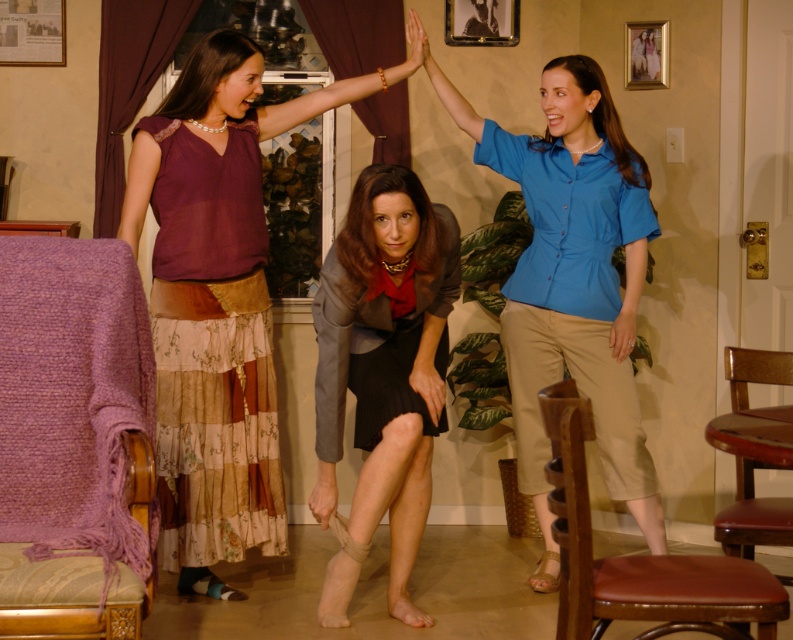
Question: Is blue button-up shirt at upper right bigger than matte gray sleeve at center?

Choices:
 (A) no
 (B) yes

Answer: (B)

Question: Which point is closer to the camera?

Choices:
 (A) (714, 580)
 (B) (156, 160)
 (C) (175, 177)

Answer: (A)

Question: Which object is the farthest from the wooden chair at lower right?

Choices:
 (A) matte gold bracelet at upper center
 (B) matte gray sleeve at center

Answer: (A)

Question: Which of these objects is positioned farthest from the blue fabric arm at upper center?

Choices:
 (A) matte gold bracelet at upper center
 (B) matte purple blouse at center
 (C) brown leather chair at lower right
 (D) matte gray sleeve at center

Answer: (C)

Question: Is matte purple blouse at upper left below blue fabric arm at upper center?

Choices:
 (A) yes
 (B) no

Answer: (A)

Question: In this image, where is matte gray blazer at center located relative to wooden chair at lower right?

Choices:
 (A) below
 (B) above

Answer: (B)